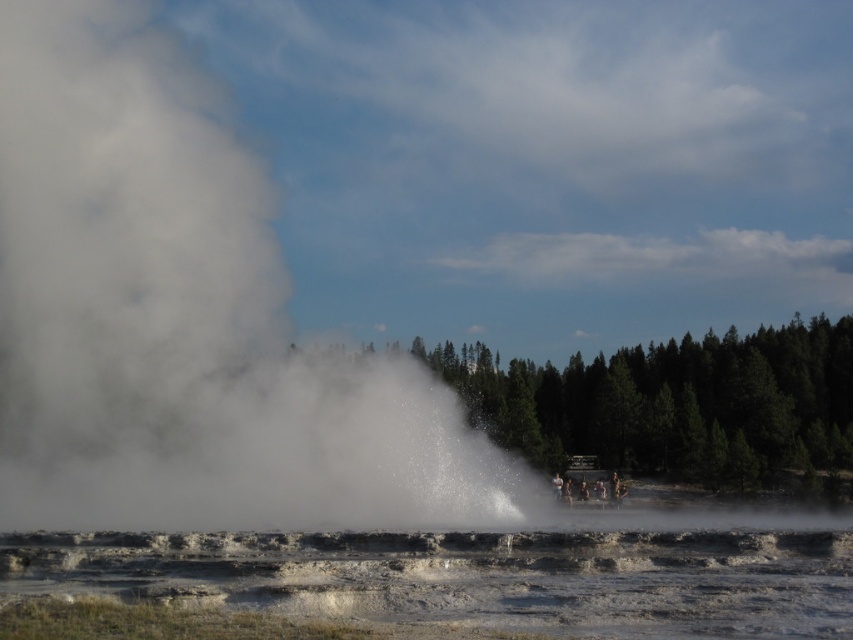
Does white vapor at center have a lesser height compared to white frothy water at center?

No.

Is white vapor at center further to the viewer compared to white frothy water at center?

Yes.

This screenshot has width=853, height=640. I want to click on white vapor at center, so click(186, 321).